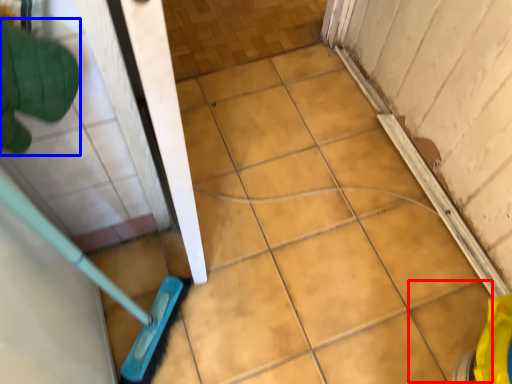
Question: Which object is closer to the camera taking this photo, ceramic tile (highlighted by a red box) or hand (highlighted by a blue box)?

Choices:
 (A) ceramic tile
 (B) hand

Answer: (B)